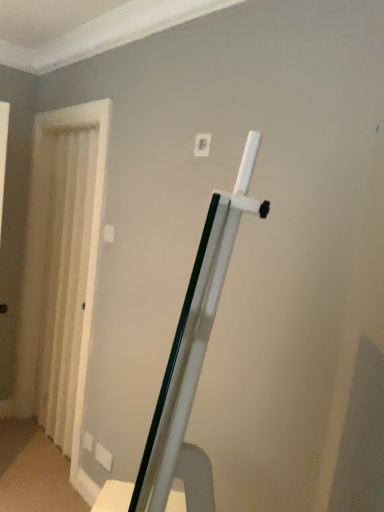
Question: Can you confirm if white textured curtain at left is thinner than white plastic light switch at upper center?

Choices:
 (A) yes
 (B) no

Answer: (B)

Question: From the image's perspective, would you say white textured curtain at left is positioned over white plastic light switch at upper center?

Choices:
 (A) yes
 (B) no

Answer: (B)

Question: From the image's perspective, is white textured curtain at left located beneath white plastic light switch at upper center?

Choices:
 (A) no
 (B) yes

Answer: (B)

Question: Can white plastic light switch at upper center be found inside white textured curtain at left?

Choices:
 (A) yes
 (B) no

Answer: (B)

Question: Is the surface of white textured curtain at left in direct contact with white plastic light switch at upper center?

Choices:
 (A) no
 (B) yes

Answer: (A)

Question: Is white textured curtain at left closer to camera compared to white plastic light switch at upper center?

Choices:
 (A) yes
 (B) no

Answer: (B)

Question: Can you see white plastic light switch at upper center touching white textured curtain at left?

Choices:
 (A) yes
 (B) no

Answer: (B)

Question: Can you confirm if white plastic light switch at upper center is smaller than white textured curtain at left?

Choices:
 (A) yes
 (B) no

Answer: (A)

Question: From a real-world perspective, is white plastic light switch at upper center physically below white textured curtain at left?

Choices:
 (A) no
 (B) yes

Answer: (A)

Question: Are white plastic light switch at upper center and white textured curtain at left located far from each other?

Choices:
 (A) yes
 (B) no

Answer: (A)

Question: Is white plastic light switch at upper center positioned with its back to white textured curtain at left?

Choices:
 (A) yes
 (B) no

Answer: (B)

Question: Is white plastic light switch at upper center facing towards white textured curtain at left?

Choices:
 (A) no
 (B) yes

Answer: (A)

Question: Would you say white textured curtain at left is inside or outside white plastic light switch at upper center?

Choices:
 (A) outside
 (B) inside

Answer: (A)